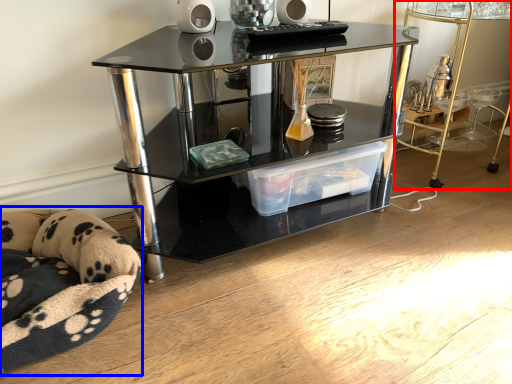
Question: Which of the following is the farthest to the observer, table (highlighted by a red box) or swivel chair (highlighted by a blue box)?

Choices:
 (A) table
 (B) swivel chair

Answer: (A)